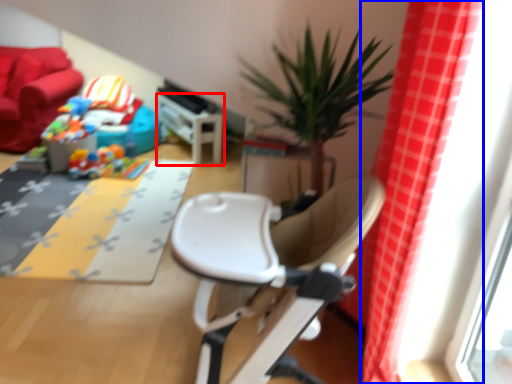
Question: Which point is closer to the camera, table (highlighted by a red box) or curtain (highlighted by a blue box)?

Choices:
 (A) table
 (B) curtain

Answer: (B)